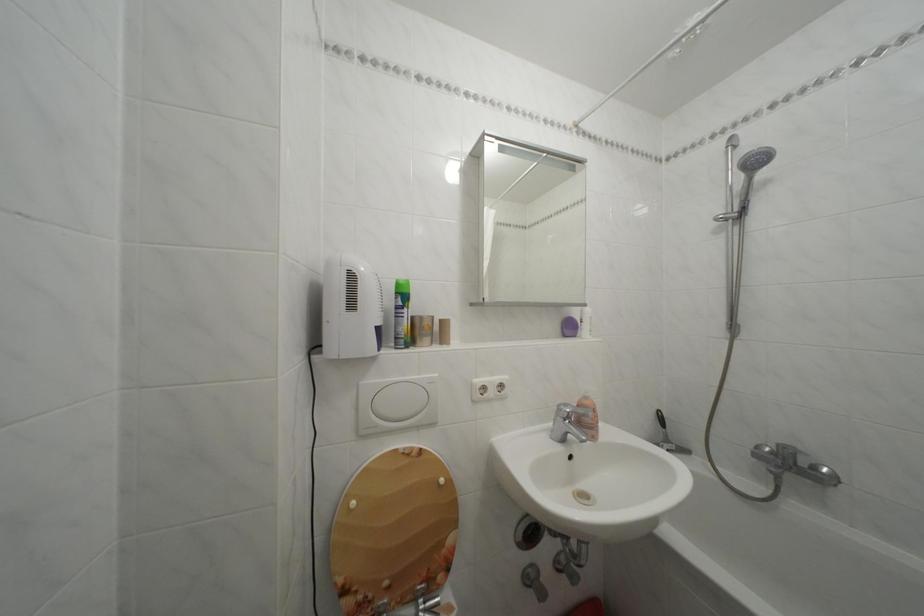
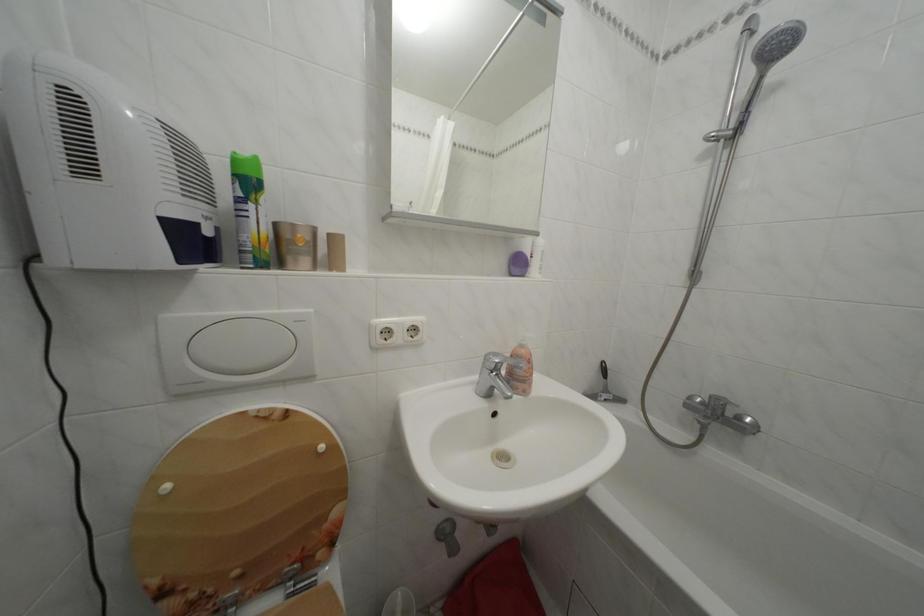
Where in the second image is the point corresponding to point 675,447 from the first image?

(614, 397)